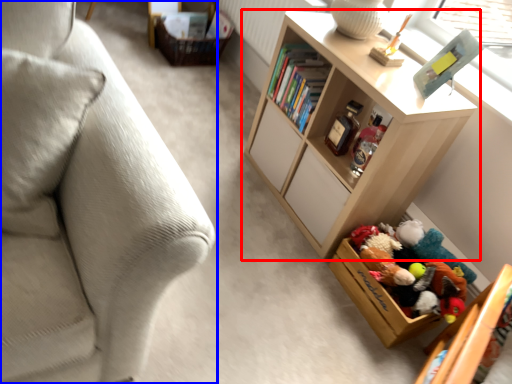
Question: Which of the following is the farthest to the observer, shelf (highlighted by a red box) or studio couch (highlighted by a blue box)?

Choices:
 (A) shelf
 (B) studio couch

Answer: (A)